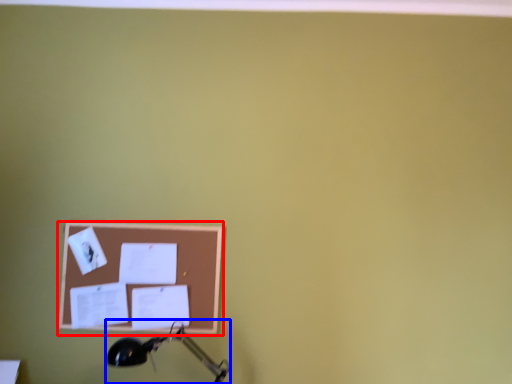
Question: Which object appears farthest to the camera in this image, picture frame (highlighted by a red box) or table lamp (highlighted by a blue box)?

Choices:
 (A) picture frame
 (B) table lamp

Answer: (A)